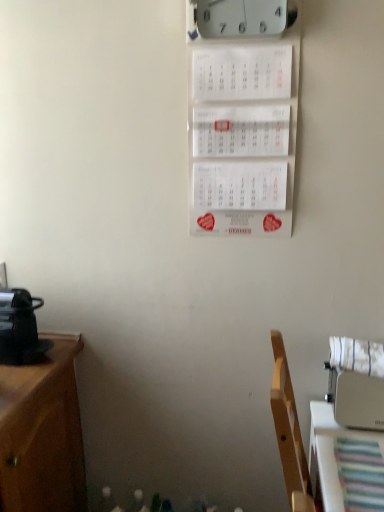
Describe the element at coordinates (328, 443) in the screenshot. I see `white fabric chair at right` at that location.

The width and height of the screenshot is (384, 512). Find the location of `white fabric chair at right`. white fabric chair at right is located at coordinates (328, 443).

What do you see at coordinates (239, 18) in the screenshot? I see `white plastic clock at upper center` at bounding box center [239, 18].

Find the location of `white plastic clock at upper center`. white plastic clock at upper center is located at coordinates (239, 18).

Locate an element on the screen. white fabric chair at right is located at coordinates (328, 443).

Considering the positions of objects white plastic clock at upper center and white fabric chair at right in the image provided, who is more to the left, white plastic clock at upper center or white fabric chair at right?

From the viewer's perspective, white plastic clock at upper center appears more on the left side.

Which object is more forward, white plastic clock at upper center or white fabric chair at right?

white fabric chair at right is in front.

Between point (290, 25) and point (352, 439), which one is positioned in front?

The point (290, 25) is closer.

Looking at this image, from the image's perspective, is white plastic clock at upper center located beneath white fabric chair at right?

Actually, white plastic clock at upper center appears above white fabric chair at right in the image.

Looking at this image, from a real-world perspective, is white plastic clock at upper center physically above white fabric chair at right?

Correct, in the physical world, white plastic clock at upper center is higher than white fabric chair at right.

Which of these two, white plastic clock at upper center or white fabric chair at right, is thinner?

With smaller width is white plastic clock at upper center.

Does white plastic clock at upper center have a lesser height compared to white fabric chair at right?

Indeed, white plastic clock at upper center has a lesser height compared to white fabric chair at right.

Considering the relative sizes of white plastic clock at upper center and white fabric chair at right in the image provided, is white plastic clock at upper center smaller than white fabric chair at right?

Indeed, white plastic clock at upper center has a smaller size compared to white fabric chair at right.

Can white fabric chair at right be found inside white plastic clock at upper center?

Actually, white fabric chair at right is outside white plastic clock at upper center.

Looking at this image, is white plastic clock at upper center not near white fabric chair at right?

Yes, white plastic clock at upper center is far from white fabric chair at right.

Could you tell me if white plastic clock at upper center is facing white fabric chair at right?

No, white plastic clock at upper center does not turn towards white fabric chair at right.

What's the angular difference between white plastic clock at upper center and white fabric chair at right's facing directions?

The angle between the facing direction of white plastic clock at upper center and the facing direction of white fabric chair at right is 90 degrees.

How far apart are white plastic clock at upper center and white fabric chair at right?

A distance of 3.37 feet exists between white plastic clock at upper center and white fabric chair at right.

This screenshot has width=384, height=512. Find the location of `furniture on the right of white plastic clock at upper center`. furniture on the right of white plastic clock at upper center is located at coordinates [328, 443].

Consider the image. Does white fabric chair at right appear on the right side of white plastic clock at upper center?

Correct, you'll find white fabric chair at right to the right of white plastic clock at upper center.

Does white fabric chair at right lie behind white plastic clock at upper center?

No, the depth of white fabric chair at right is less than that of white plastic clock at upper center.

Which is closer, (x=305, y=507) or (x=240, y=32)?

Point (x=305, y=507)

From the image's perspective, between white fabric chair at right and white plastic clock at upper center, which one is located above?

white plastic clock at upper center, from the image's perspective.

From a real-world perspective, is white fabric chair at right physically above white plastic clock at upper center?

No.

Between white fabric chair at right and white plastic clock at upper center, which one has smaller width?

white plastic clock at upper center.

Does white fabric chair at right have a lesser height compared to white plastic clock at upper center?

No.

Who is bigger, white fabric chair at right or white plastic clock at upper center?

white fabric chair at right is bigger.

Is white fabric chair at right inside or outside of white plastic clock at upper center?

white fabric chair at right is outside white plastic clock at upper center.

Consider the image. Is white fabric chair at right far from white plastic clock at upper center?

Indeed, white fabric chair at right is not near white plastic clock at upper center.

Is white fabric chair at right turned away from white plastic clock at upper center?

No, white fabric chair at right's orientation is not away from white plastic clock at upper center.

Locate an element on the screen. This screenshot has height=512, width=384. furniture on the right of white plastic clock at upper center is located at coordinates 328,443.

Identify the location of furniture on the right side of white plastic clock at upper center. This screenshot has height=512, width=384. (328, 443).

Identify the location of clock above the white fabric chair at right (from a real-world perspective). (239, 18).